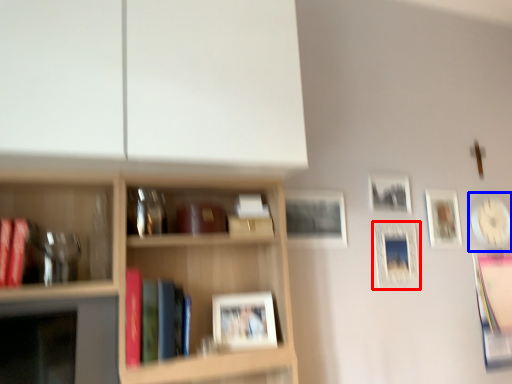
Question: Among these objects, which one is farthest to the camera, picture frame (highlighted by a red box) or picture frame (highlighted by a blue box)?

Choices:
 (A) picture frame
 (B) picture frame

Answer: (B)